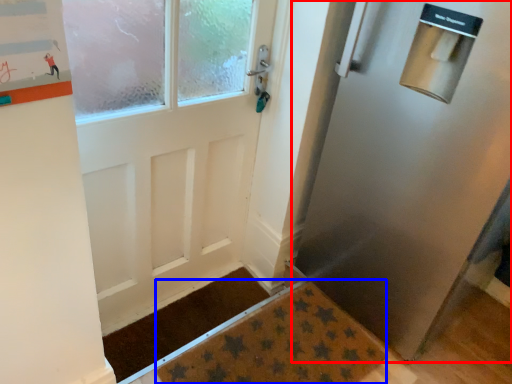
Question: Which object appears farthest to the camera in this image, door (highlighted by a red box) or doormat (highlighted by a blue box)?

Choices:
 (A) door
 (B) doormat

Answer: (B)